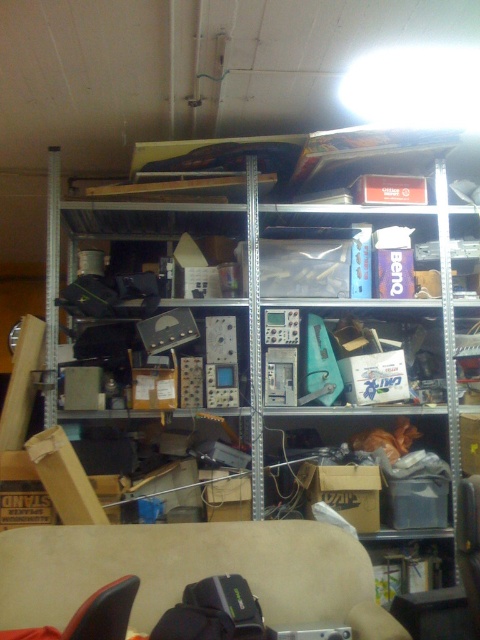
You are organizing the storage area and need to place a new item on the shelf. The new item is taller than the beige fabric couch at lower center but shorter than the metallic gray electronics at center. Where should you place it?

You should place the new item on the same shelf as the metallic gray electronics at center because it is taller than the beige fabric couch at lower center but shorter than the metallic gray electronics at center, ensuring proper stacking based on height.

You are trying to move a large object from the top shelf to the bottom shelf. The bottom shelf has limited space. Which object, the metallic gray electronics at center or the beige fabric couch at lower center, will require more space on the bottom shelf?

The metallic gray electronics at center will require more space on the bottom shelf because its width surpasses that of the beige fabric couch at lower center.